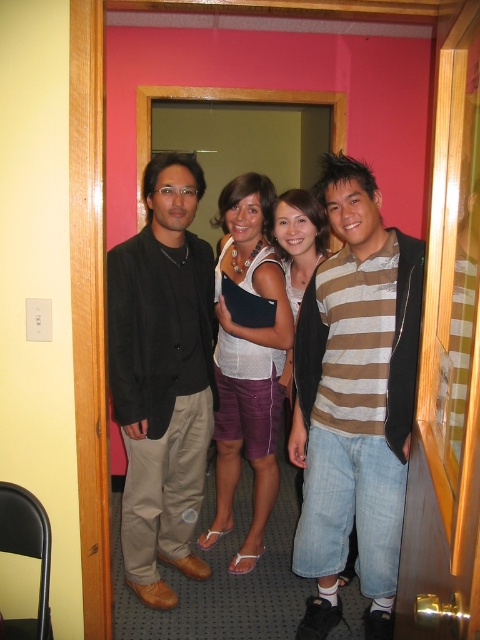
You are a photographer setting up a shoot in the scene described. You need to ensure that the brown striped shirt at center and the matte white tank top at center are both visible in the frame. Based on their positions, which one should you focus on first to capture both in the shot?

The brown striped shirt at center is located below the matte white tank top at center, so you should focus on the matte white tank top at center first to ensure both are in the frame.

You are organizing a clothing donation drive and need to categorize items by size. You have two shirts in front of you, the brown striped shirt at center and the matte white tank top at center. Based on their appearance, which shirt would you place in the smaller size category?

The brown striped shirt at center is thinner than the matte white tank top at center, so it should be placed in the smaller size category.